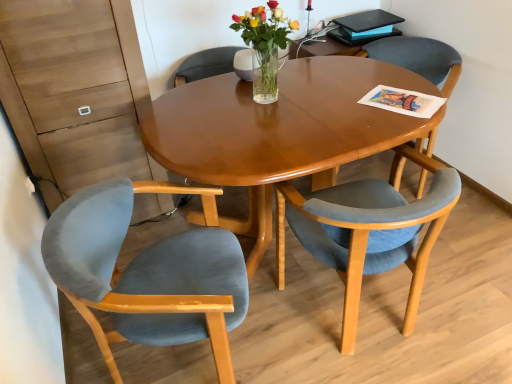
Question: Considering their positions, is velvet blue chair at center, the 3th chair in the left-to-right sequence, located in front of or behind velvet blue chair at lower right, arranged as the second chair when viewed from the left?

Choices:
 (A) behind
 (B) front

Answer: (A)

Question: Considering the positions of point (420, 170) and point (434, 228), is point (420, 170) closer or farther from the camera than point (434, 228)?

Choices:
 (A) closer
 (B) farther

Answer: (B)

Question: Based on their relative distances, which object is farther from the matte black magazine at upper right?

Choices:
 (A) velvet blue chair at lower right, arranged as the second chair when viewed from the left
 (B) velvet blue chair at center, the 3th chair in the left-to-right sequence
 (C) velvet blue chair at lower left, placed as the 1th chair when sorted from left to right
 (D) clear glass vase at center

Answer: (C)

Question: Estimate the real-world distances between objects in this image. Which object is farther from the velvet blue chair at lower right, which appears as the second chair when viewed from the right?

Choices:
 (A) matte black magazine at upper right
 (B) velvet blue chair at center, the 3th chair in the left-to-right sequence
 (C) velvet blue chair at lower left, placed as the 1th chair when sorted from left to right
 (D) clear glass vase at center

Answer: (A)